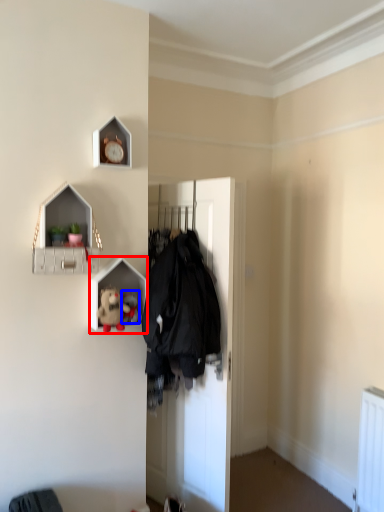
Question: Which of the following is the farthest to the observer, shelf (highlighted by a red box) or toy (highlighted by a blue box)?

Choices:
 (A) shelf
 (B) toy

Answer: (B)